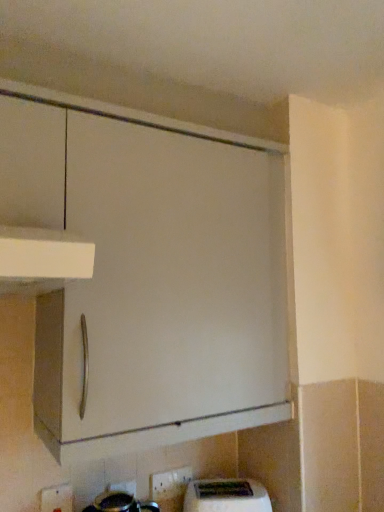
Question: Considering the relative sizes of white plastic electric outlet at lower center, the 2th electric outlet when ordered from right to left, and white glossy electric outlet at lower center, arranged as the 2th electric outlet when viewed from the left, in the image provided, is white plastic electric outlet at lower center, the 2th electric outlet when ordered from right to left, wider than white glossy electric outlet at lower center, arranged as the 2th electric outlet when viewed from the left,?

Choices:
 (A) no
 (B) yes

Answer: (B)

Question: Is white plastic electric outlet at lower center, which is the 1th electric outlet in left-to-right order, to the left of white glossy electric outlet at lower center, arranged as the 2th electric outlet when viewed from the left, from the viewer's perspective?

Choices:
 (A) yes
 (B) no

Answer: (A)

Question: Is white glossy electric outlet at lower center, which is counted as the second electric outlet, starting from the front, surrounded by white plastic electric outlet at lower center, which is the 1th electric outlet in left-to-right order?

Choices:
 (A) yes
 (B) no

Answer: (B)

Question: Is white plastic electric outlet at lower center, arranged as the first electric outlet when viewed from the front, positioned behind white glossy electric outlet at lower center, arranged as the 2th electric outlet when viewed from the left?

Choices:
 (A) yes
 (B) no

Answer: (B)

Question: Considering the relative sizes of white plastic electric outlet at lower center, which is the 1th electric outlet in left-to-right order, and white glossy electric outlet at lower center, which is counted as the second electric outlet, starting from the front, in the image provided, is white plastic electric outlet at lower center, which is the 1th electric outlet in left-to-right order, shorter than white glossy electric outlet at lower center, which is counted as the second electric outlet, starting from the front,?

Choices:
 (A) yes
 (B) no

Answer: (B)

Question: Is white plastic toaster at lower center to the left or to the right of white glossy electric outlet at lower center, arranged as the 2th electric outlet when viewed from the left, in the image?

Choices:
 (A) right
 (B) left

Answer: (A)

Question: From a real-world perspective, is white plastic toaster at lower center above or below white glossy electric outlet at lower center, arranged as the 2th electric outlet when viewed from the left?

Choices:
 (A) above
 (B) below

Answer: (B)

Question: From the image's perspective, is white plastic toaster at lower center located above or below white glossy electric outlet at lower center, which is counted as the second electric outlet, starting from the front?

Choices:
 (A) above
 (B) below

Answer: (B)

Question: From their relative heights in the image, would you say white plastic toaster at lower center is taller or shorter than white glossy electric outlet at lower center, which is counted as the second electric outlet, starting from the front?

Choices:
 (A) short
 (B) tall

Answer: (B)

Question: Considering the positions of white plastic toaster at lower center and white plastic electric outlet at lower center, which is the 1th electric outlet in left-to-right order, in the image, is white plastic toaster at lower center bigger or smaller than white plastic electric outlet at lower center, which is the 1th electric outlet in left-to-right order,?

Choices:
 (A) big
 (B) small

Answer: (A)

Question: Considering the positions of point (244, 505) and point (67, 496), is point (244, 505) closer or farther from the camera than point (67, 496)?

Choices:
 (A) farther
 (B) closer

Answer: (A)

Question: Do you think white plastic toaster at lower center is within white plastic electric outlet at lower center, arranged as the first electric outlet when viewed from the front, or outside of it?

Choices:
 (A) outside
 (B) inside

Answer: (A)

Question: Considering the positions of white plastic toaster at lower center and white plastic electric outlet at lower center, which is the 1th electric outlet in left-to-right order, in the image, is white plastic toaster at lower center taller or shorter than white plastic electric outlet at lower center, which is the 1th electric outlet in left-to-right order,?

Choices:
 (A) short
 (B) tall

Answer: (A)

Question: From the image's perspective, is white plastic electric outlet at lower center, arranged as the 2th electric outlet when viewed from the back, above or below white glossy electric outlet at lower center, which ranks as the 1th electric outlet in right-to-left order?

Choices:
 (A) below
 (B) above

Answer: (B)

Question: Would you say white plastic electric outlet at lower center, arranged as the 2th electric outlet when viewed from the back, is to the left or to the right of white glossy electric outlet at lower center, the first electric outlet positioned from the back, in the picture?

Choices:
 (A) right
 (B) left

Answer: (B)